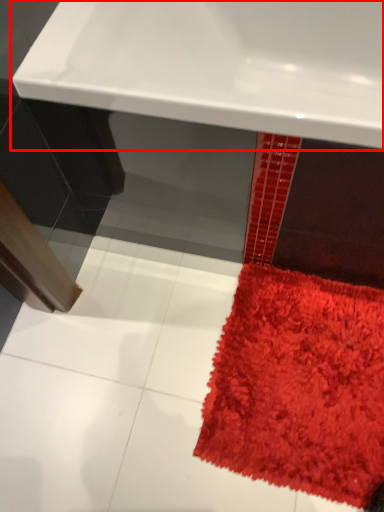
Question: Where is sink (annotated by the red box) located in relation to mat in the image?

Choices:
 (A) left
 (B) right

Answer: (A)